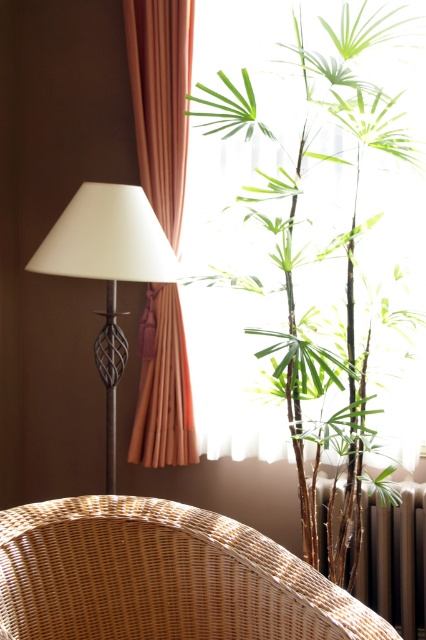
Question: Can you confirm if orange fabric curtain at left is positioned below metallic silver radiator at lower right?

Choices:
 (A) no
 (B) yes

Answer: (A)

Question: Observing the image, what is the correct spatial positioning of green matte bamboo at center in reference to matte white lamp at left?

Choices:
 (A) above
 (B) below

Answer: (A)

Question: Which of the following is the farthest from the observer?

Choices:
 (A) orange fabric curtain at left
 (B) woven wicker armchair at lower left
 (C) green matte bamboo at center
 (D) matte white lamp at left

Answer: (A)

Question: Considering the real-world distances, which object is farthest from the woven wicker armchair at lower left?

Choices:
 (A) orange fabric curtain at left
 (B) green matte bamboo at center
 (C) metallic silver radiator at lower right

Answer: (A)

Question: Does orange fabric curtain at left appear under metallic silver radiator at lower right?

Choices:
 (A) yes
 (B) no

Answer: (B)

Question: Which of these objects is positioned farthest from the matte white lamp at left?

Choices:
 (A) orange fabric curtain at left
 (B) metallic silver radiator at lower right
 (C) woven wicker armchair at lower left

Answer: (B)